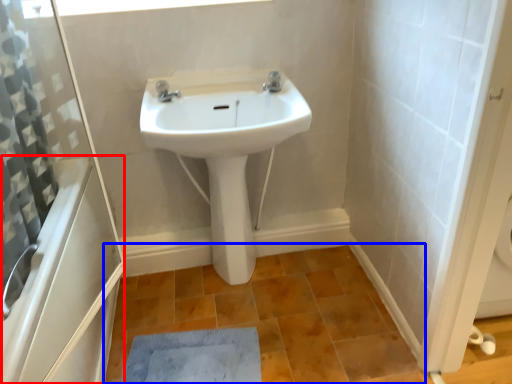
Question: Which object is closer to the camera taking this photo, bath (highlighted by a red box) or ceramic tile (highlighted by a blue box)?

Choices:
 (A) bath
 (B) ceramic tile

Answer: (A)